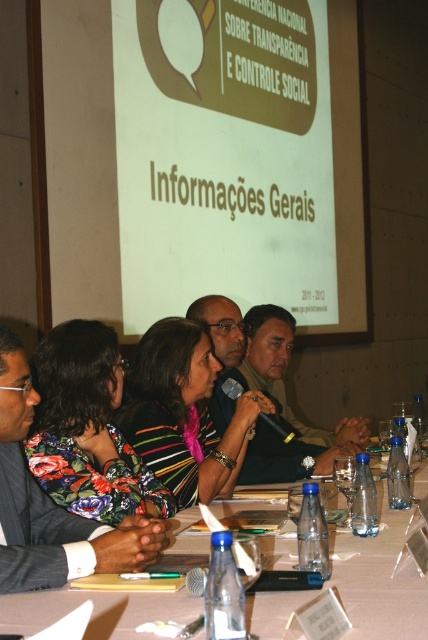
You are attending a conference and need to place a small item on the table. You have two spots to choose from, one at point (357, 557) and another at point (201, 305). Which spot is closer to you?

Point (357, 557) is closer to the viewer than point (201, 305), so you should place the item there.

You are organizing a conference and need to place a large banner behind the white plastic table at center. Based on the scene description, where should you position the banner relative to the table?

The banner should be placed behind the white plastic table at center, which is located at the center of the image according to the coordinates provided in the Objects Description.